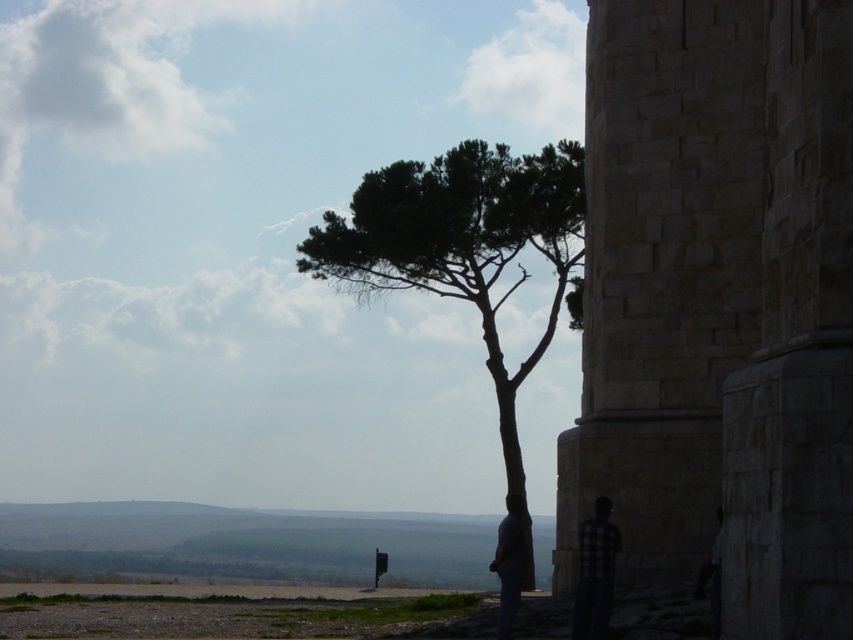
Locate an element on the screen. Image resolution: width=853 pixels, height=640 pixels. green leafy tree at center is located at coordinates (462, 243).

Who is more distant from viewer, (567, 237) or (581, 538)?

The point (567, 237) is behind.

Does point (355, 198) come in front of point (582, 592)?

No, it is behind (582, 592).

Identify the location of green leafy tree at center. (462, 243).

Does stone tower at right appear on the right side of dark blue jeans at lower center?

Yes, stone tower at right is to the right of dark blue jeans at lower center.

Between stone tower at right and dark blue jeans at lower center, which one appears on the left side from the viewer's perspective?

dark blue jeans at lower center

The image size is (853, 640). What do you see at coordinates (720, 301) in the screenshot?
I see `stone tower at right` at bounding box center [720, 301].

Where is `stone tower at right`? This screenshot has height=640, width=853. stone tower at right is located at coordinates (720, 301).

This screenshot has width=853, height=640. What do you see at coordinates (720, 301) in the screenshot?
I see `stone tower at right` at bounding box center [720, 301].

Based on the photo, who is more forward, (815, 38) or (608, 502)?

Point (815, 38)

Who is more distant from viewer, [834,97] or [601,525]?

Positioned behind is point [601,525].

You are a GUI agent. You are given a task and a screenshot of the screen. Output one action in this format:
    pyautogui.click(x=<x>, y=<y>)
    Task: Click on the stone tower at right
    This screenshot has width=853, height=640.
    Given the screenshot: What is the action you would take?
    pyautogui.click(x=720, y=301)